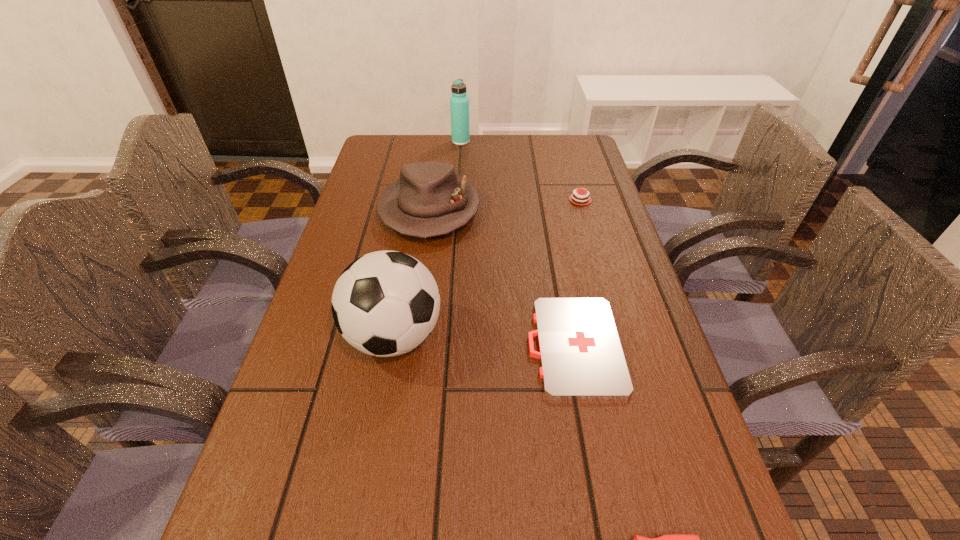
You are a GUI agent. You are given a task and a screenshot of the screen. Output one action in this format:
    pyautogui.click(x=<x>, y=<y>)
    Task: Click on the farthest object
    This screenshot has height=540, width=960.
    Given the screenshot: What is the action you would take?
    pyautogui.click(x=459, y=102)

Image resolution: width=960 pixels, height=540 pixels. In order to click on soccer ball in this screenshot , I will do `click(386, 303)`.

Where is `hat`? hat is located at coordinates (429, 199).

Where is `chocolate cake`? The height and width of the screenshot is (540, 960). chocolate cake is located at coordinates (576, 198).

The height and width of the screenshot is (540, 960). In order to click on the first-aid kit in this screenshot , I will do `click(581, 356)`.

Identify the location of vacant point located 0.110m on the right of the thermos bottle. The width and height of the screenshot is (960, 540). (502, 141).

At what (x,y) coordinates should I click in order to perform the action: click on free spot located 0.190m on the right of the soccer ball. Please return your answer as a coordinate pair (x, y). The image size is (960, 540). Looking at the image, I should click on (536, 336).

Find the location of a particular element. The image size is (960, 540). vacant position located 0.340m on the decorative side of the third tallest object is located at coordinates click(x=409, y=359).

Where is `vacant space located 0.320m on the left of the chocolate cake`? Image resolution: width=960 pixels, height=540 pixels. vacant space located 0.320m on the left of the chocolate cake is located at coordinates (440, 200).

Where is `free region located on handle side the shortest object`? free region located on handle side the shortest object is located at coordinates (330, 346).